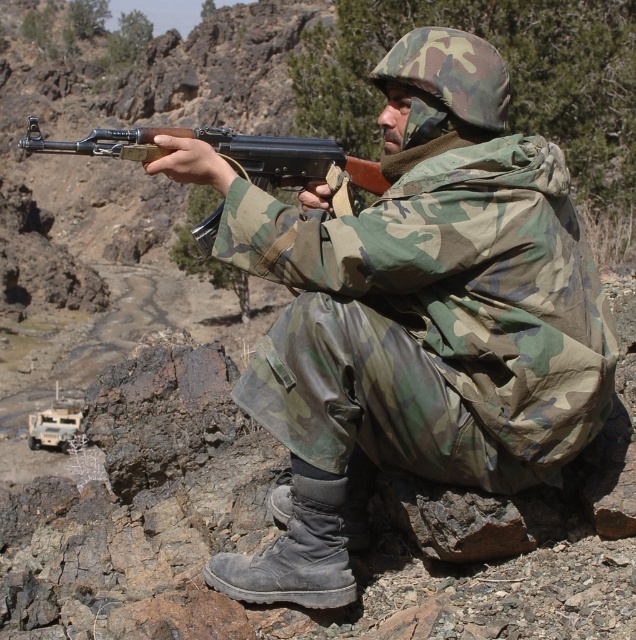
Consider the image. You are a drone operator controlling a drone that is 3 meters in height. You need to capture a close shot of the point at coordinates (583, 392) in the image. Given that the distance between the point and the camera is 7.49 meters, will your drone be able to get closer than 5 meters to the point without violating the safety distance of 3 meters from the subject?

The distance between the point and the camera is 7.49 meters. To maintain a safety distance of 3 meters from the subject, the drone must stay at least 3 meters away. Since the drone is already 7.49 meters away, it can move closer to within 5 meters while still maintaining the required safety distance of 3 meters. Therefore, the drone can get closer than 5 meters to the point.

You are a military strategist analyzing the terrain. You notice the rough textured rock at center and the matte black shotgun at center. Which object is wider?

The matte black shotgun at center is wider than the rough textured rock at center.

You are a military observer analyzing the image. You need to determine the relative height of the camo fabric uniform at center and the matte black shotgun at center. Which object is shorter?

The camo fabric uniform at center is shorter than the matte black shotgun at center.